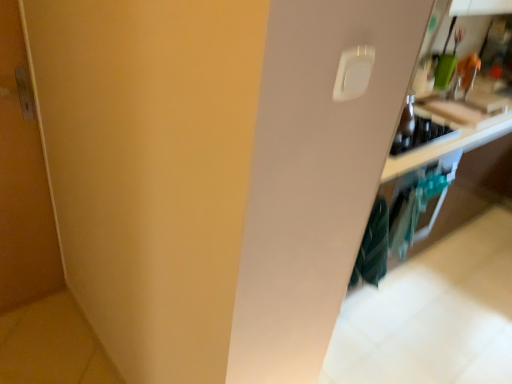
This screenshot has width=512, height=384. What do you see at coordinates (373, 247) in the screenshot?
I see `teal striped fabric at lower right` at bounding box center [373, 247].

This screenshot has width=512, height=384. Describe the element at coordinates (469, 107) in the screenshot. I see `wooden cutting board at upper right` at that location.

Where is `teal striped fabric at lower right`? teal striped fabric at lower right is located at coordinates (373, 247).

Can you confirm if white plastic light switch at upper right is wider than teal striped fabric at lower right?

In fact, white plastic light switch at upper right might be narrower than teal striped fabric at lower right.

Could you tell me if white plastic light switch at upper right is turned towards teal striped fabric at lower right?

No, white plastic light switch at upper right is not facing towards teal striped fabric at lower right.

Is white plastic light switch at upper right directly adjacent to teal striped fabric at lower right?

No, white plastic light switch at upper right is not making contact with teal striped fabric at lower right.

How different are the orientations of white plastic light switch at upper right and teal striped fabric at lower right in degrees?

The facing directions of white plastic light switch at upper right and teal striped fabric at lower right are 0.00205 degrees apart.

Between point (354, 88) and point (457, 113), which one is positioned in front?

The point (354, 88) is closer to the camera.

Which object is thinner, white plastic light switch at upper right or wooden cutting board at upper right?

white plastic light switch at upper right.

At what (x,y) coordinates should I click in order to perform the action: click on sink lying on the right of white plastic light switch at upper right. Please return your answer as a coordinate pair (x, y). The height and width of the screenshot is (384, 512). Looking at the image, I should click on (469, 107).

Could you tell me if white plastic light switch at upper right is turned towards wooden cutting board at upper right?

No, white plastic light switch at upper right is not oriented towards wooden cutting board at upper right.

Can we say teal striped fabric at lower right lies outside white plastic light switch at upper right?

Absolutely, teal striped fabric at lower right is external to white plastic light switch at upper right.

Locate an element on the screen. The height and width of the screenshot is (384, 512). laundry lying behind the white plastic light switch at upper right is located at coordinates (373, 247).

How many degrees apart are the facing directions of teal striped fabric at lower right and white plastic light switch at upper right?

0.00205 degrees separate the facing orientations of teal striped fabric at lower right and white plastic light switch at upper right.

Between teal striped fabric at lower right and white plastic light switch at upper right, which one appears on the left side from the viewer's perspective?

white plastic light switch at upper right.

Does teal striped fabric at lower right have a larger size compared to wooden cutting board at upper right?

Yes, teal striped fabric at lower right is bigger than wooden cutting board at upper right.

From a real-world perspective, who is located lower, teal striped fabric at lower right or wooden cutting board at upper right?

In real-world perspective, teal striped fabric at lower right is lower.

Is point (377, 239) closer or farther from the camera than point (492, 93)?

Clearly, point (377, 239) is closer to the camera than point (492, 93).

Is teal striped fabric at lower right in front of or behind wooden cutting board at upper right in the image?

Clearly, teal striped fabric at lower right is in front of wooden cutting board at upper right.

Who is bigger, white plastic light switch at upper right or matte wood door at left?

matte wood door at left.

Is white plastic light switch at upper right to the left of matte wood door at left from the viewer's perspective?

No, white plastic light switch at upper right is not to the left of matte wood door at left.

Can you confirm if white plastic light switch at upper right is thinner than matte wood door at left?

Yes, white plastic light switch at upper right is thinner than matte wood door at left.

Can we say matte wood door at left lies outside teal striped fabric at lower right?

Absolutely, matte wood door at left is external to teal striped fabric at lower right.

Considering the sizes of objects matte wood door at left and teal striped fabric at lower right in the image provided, who is wider, matte wood door at left or teal striped fabric at lower right?

Wider between the two is teal striped fabric at lower right.

From a real-world perspective, which object rests below the other?

teal striped fabric at lower right is physically lower.

Is matte wood door at left oriented away from teal striped fabric at lower right?

No, matte wood door at left's orientation is not away from teal striped fabric at lower right.

Is point (468, 105) farther from camera compared to point (380, 241)?

Yes, point (468, 105) is behind point (380, 241).

Considering the relative sizes of wooden cutting board at upper right and teal striped fabric at lower right in the image provided, is wooden cutting board at upper right wider than teal striped fabric at lower right?

Correct, the width of wooden cutting board at upper right exceeds that of teal striped fabric at lower right.

In the scene shown: Considering the relative positions of wooden cutting board at upper right and teal striped fabric at lower right in the image provided, is wooden cutting board at upper right behind teal striped fabric at lower right?

Yes, the depth of wooden cutting board at upper right is greater than that of teal striped fabric at lower right.

Which is more to the left, wooden cutting board at upper right or teal striped fabric at lower right?

Answer: teal striped fabric at lower right.

You are a GUI agent. You are given a task and a screenshot of the screen. Output one action in this format:
    pyautogui.click(x=<x>, y=<y>)
    Task: Click on the laundry behind the white plastic light switch at upper right
    
    Given the screenshot: What is the action you would take?
    pyautogui.click(x=373, y=247)

Identify the location of sink above the white plastic light switch at upper right (from the image's perspective). The image size is (512, 384). (469, 107).

When comparing their distances from white plastic light switch at upper right, does wooden cutting board at upper right or teal striped fabric at lower right seem closer?

The object closer to white plastic light switch at upper right is teal striped fabric at lower right.

Which object lies further to the anchor point teal striped fabric at lower right, white plastic light switch at upper right or wooden cutting board at upper right?

white plastic light switch at upper right is further to teal striped fabric at lower right.

Based on their spatial positions, is white plastic light switch at upper right or wooden cutting board at upper right closer to matte wood door at left?

white plastic light switch at upper right lies closer to matte wood door at left than the other object.

When comparing their distances from wooden cutting board at upper right, does teal striped fabric at lower right or white plastic light switch at upper right seem closer?

teal striped fabric at lower right is positioned closer to the anchor wooden cutting board at upper right.

Based on their spatial positions, is teal striped fabric at lower right or wooden cutting board at upper right further from white plastic light switch at upper right?

The object further to white plastic light switch at upper right is wooden cutting board at upper right.

Estimate the real-world distances between objects in this image. Which object is further from wooden cutting board at upper right, white plastic light switch at upper right or matte wood door at left?

matte wood door at left lies further to wooden cutting board at upper right than the other object.

From the image, which object appears to be nearer to white plastic light switch at upper right, wooden cutting board at upper right or matte wood door at left?

Among the two, matte wood door at left is located nearer to white plastic light switch at upper right.

Looking at the image, which one is located further to matte wood door at left, teal striped fabric at lower right or white plastic light switch at upper right?

The object further to matte wood door at left is white plastic light switch at upper right.

Where is `laundry positioned between white plastic light switch at upper right and wooden cutting board at upper right from near to far`? This screenshot has height=384, width=512. laundry positioned between white plastic light switch at upper right and wooden cutting board at upper right from near to far is located at coordinates (373, 247).

Locate an element on the screen. laundry between matte wood door at left and wooden cutting board at upper right is located at coordinates (373, 247).

At what (x,y) coordinates should I click in order to perform the action: click on light switch between matte wood door at left and wooden cutting board at upper right in the horizontal direction. Please return your answer as a coordinate pair (x, y). This screenshot has height=384, width=512. Looking at the image, I should click on (353, 73).

Locate an element on the screen. This screenshot has width=512, height=384. light switch located between matte wood door at left and teal striped fabric at lower right in the left-right direction is located at coordinates (353, 73).